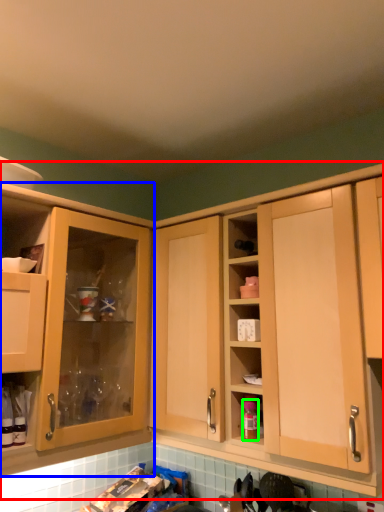
Question: Based on their relative distances, which object is nearer to cabinetry (highlighted by a red box)? Choose from cabinetry (highlighted by a blue box) and bottle (highlighted by a green box).

Choices:
 (A) cabinetry
 (B) bottle

Answer: (B)